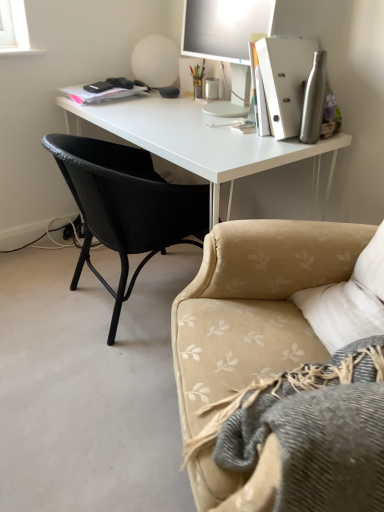
Locate an element on the screen. The height and width of the screenshot is (512, 384). silver metallic water bottle at right is located at coordinates (314, 100).

At what (x,y) coordinates should I click in order to perform the action: click on matte silver monitor at upper right. Please return your answer as a coordinate pair (x, y). The width and height of the screenshot is (384, 512). Looking at the image, I should click on (224, 28).

At what (x,y) coordinates should I click in order to perform the action: click on black woven chair at left. Please return your answer as a coordinate pair (x, y). Looking at the image, I should click on (126, 206).

Identify the location of white matte desk at center. Image resolution: width=384 pixels, height=512 pixels. (203, 143).

Is black woven chair at left not near white matte desk at center?

They are positioned close to each other.

Which is correct: black woven chair at left is inside white matte desk at center, or outside of it?

black woven chair at left is spatially positioned inside white matte desk at center.

From the image's perspective, between black woven chair at left and white matte desk at center, which one is located above?

white matte desk at center appears higher in the image.

Is point (121, 155) less distant than point (205, 137)?

No, it is not.

Is white matte desk at center behind black woven chair at left?

Yes.

How many degrees apart are the facing directions of white matte desk at center and black woven chair at left?

white matte desk at center and black woven chair at left are facing 177 degrees away from each other.

Measure the distance from white matte desk at center to black woven chair at left.

The distance of white matte desk at center from black woven chair at left is 24.19 centimeters.

The height and width of the screenshot is (512, 384). What are the coordinates of `chair below the white matte desk at center (from a real-world perspective)` in the screenshot? It's located at (126, 206).

Between silver metallic water bottle at right and matte silver monitor at upper right, which one has larger width?

matte silver monitor at upper right.

From a real-world perspective, who is located lower, silver metallic water bottle at right or matte silver monitor at upper right?

silver metallic water bottle at right, from a real-world perspective.

Who is smaller, silver metallic water bottle at right or matte silver monitor at upper right?

silver metallic water bottle at right.

Would you consider silver metallic water bottle at right to be distant from matte silver monitor at upper right?

silver metallic water bottle at right is actually quite close to matte silver monitor at upper right.

Are white matte desk at center and beige floral fabric couch at lower right located far from each other?

They are positioned close to each other.

Is white matte desk at center looking in the opposite direction of beige floral fabric couch at lower right?

No, beige floral fabric couch at lower right is not at the back of white matte desk at center.

Which of these two, white matte desk at center or beige floral fabric couch at lower right, stands shorter?

Standing shorter between the two is beige floral fabric couch at lower right.

Based on the photo, which object is further away from the camera, white matte desk at center or beige floral fabric couch at lower right?

Positioned behind is white matte desk at center.

From the image's perspective, which one is positioned lower, matte silver monitor at upper right or white matte desk at center?

white matte desk at center appears lower in the image.

Who is taller, matte silver monitor at upper right or white matte desk at center?

white matte desk at center is taller.

Measure the distance between matte silver monitor at upper right and white matte desk at center.

matte silver monitor at upper right is 36.94 centimeters away from white matte desk at center.

Based on their positions, is matte silver monitor at upper right located to the left or right of white matte desk at center?

In the image, matte silver monitor at upper right appears on the right side of white matte desk at center.

Based on their sizes in the image, would you say beige floral fabric couch at lower right is bigger or smaller than black woven chair at left?

Clearly, beige floral fabric couch at lower right is smaller in size than black woven chair at left.

Which is behind, point (206, 330) or point (118, 249)?

The point (118, 249) is behind.

Is beige floral fabric couch at lower right turned away from black woven chair at left?

No.

From a real-world perspective, which is physically below, beige floral fabric couch at lower right or black woven chair at left?

From a 3D spatial view, black woven chair at left is below.

Would you say beige floral fabric couch at lower right is to the left or to the right of white matte desk at center in the picture?

beige floral fabric couch at lower right is positioned on white matte desk at center's right side.

Who is taller, beige floral fabric couch at lower right or white matte desk at center?

white matte desk at center.

From the picture: Can you confirm if beige floral fabric couch at lower right is smaller than white matte desk at center?

Correct, beige floral fabric couch at lower right occupies less space than white matte desk at center.

Which is farther, (208,251) or (259,145)?

The point (259,145) is farther from the camera.

The width and height of the screenshot is (384, 512). Identify the location of chair on the left of white matte desk at center. (126, 206).

The width and height of the screenshot is (384, 512). What are the coordinates of `desk that is above the black woven chair at left (from the image's perspective)` in the screenshot? It's located at (203, 143).

Based on their spatial positions, is beige floral fabric couch at lower right or silver metallic water bottle at right closer to matte silver monitor at upper right?

silver metallic water bottle at right is positioned closer to the anchor matte silver monitor at upper right.

Consider the image. Looking at the image, which one is located closer to matte silver monitor at upper right, black woven chair at left or white matte desk at center?

white matte desk at center is closer to matte silver monitor at upper right.

Which object lies further to the anchor point white matte desk at center, black woven chair at left or beige floral fabric couch at lower right?

beige floral fabric couch at lower right is further to white matte desk at center.

Based on their spatial positions, is matte silver monitor at upper right or silver metallic water bottle at right further from beige floral fabric couch at lower right?

Based on the image, matte silver monitor at upper right appears to be further to beige floral fabric couch at lower right.

From the image, which object appears to be nearer to beige floral fabric couch at lower right, black woven chair at left or silver metallic water bottle at right?

The object closer to beige floral fabric couch at lower right is black woven chair at left.

When comparing their distances from beige floral fabric couch at lower right, does black woven chair at left or white matte desk at center seem further?

The object further to beige floral fabric couch at lower right is black woven chair at left.

Which object lies nearer to the anchor point white matte desk at center, beige floral fabric couch at lower right or silver metallic water bottle at right?

silver metallic water bottle at right is positioned closer to the anchor white matte desk at center.

Estimate the real-world distances between objects in this image. Which object is further from silver metallic water bottle at right, white matte desk at center or matte silver monitor at upper right?

white matte desk at center.

In order to click on bottle between matte silver monitor at upper right and white matte desk at center in the up-down direction in this screenshot , I will do `click(314, 100)`.

I want to click on chair between silver metallic water bottle at right and beige floral fabric couch at lower right in the up-down direction, so click(x=126, y=206).

Find the location of a particular element. desk located between black woven chair at left and silver metallic water bottle at right in the left-right direction is located at coordinates (x=203, y=143).

Identify the location of chair between beige floral fabric couch at lower right and white matte desk at center along the z-axis. (126, 206).